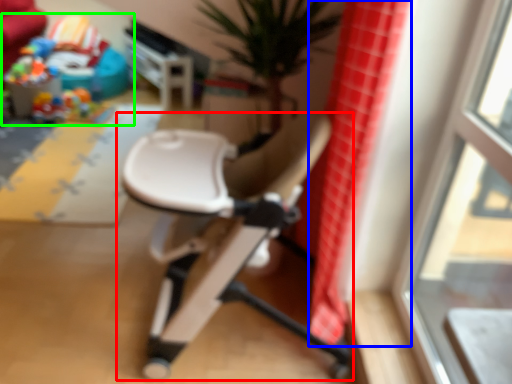
Question: Which object is positioned farthest from chair (highlighted by a red box)? Select from shower curtain (highlighted by a blue box) and toy (highlighted by a green box).

Choices:
 (A) shower curtain
 (B) toy

Answer: (B)